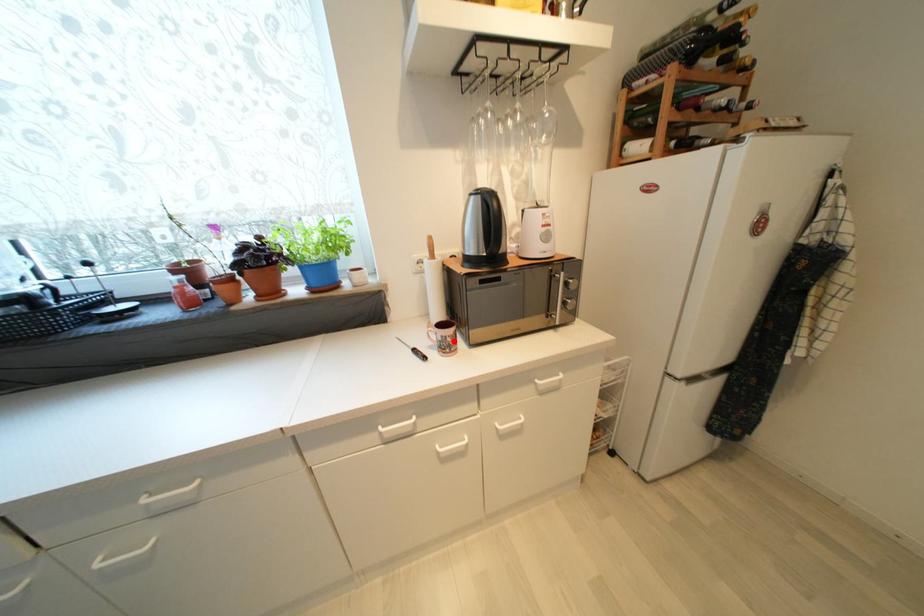
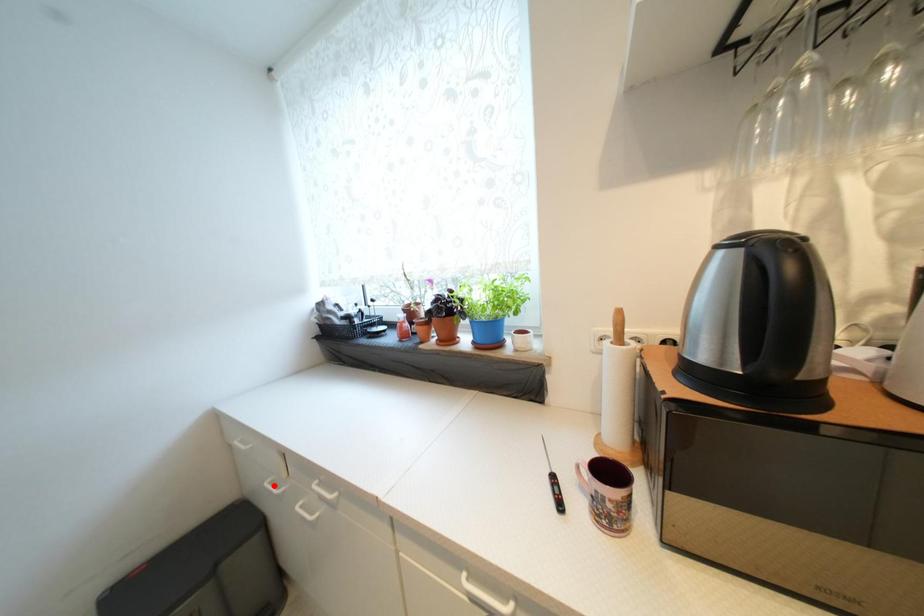
I am providing you with two images of the same scene from different viewpoints. A red point is marked on the first image and another point is marked on the second image. Does the point marked in image1 correspond to the same location as the one in image2?

No